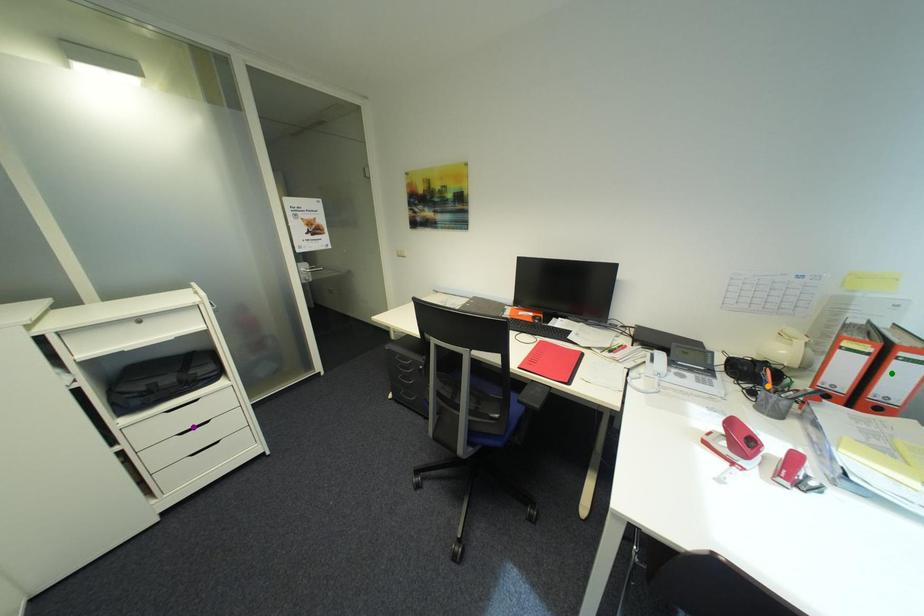
Order these from nearest to farthest:
green point | purple point | orange point

green point, orange point, purple point